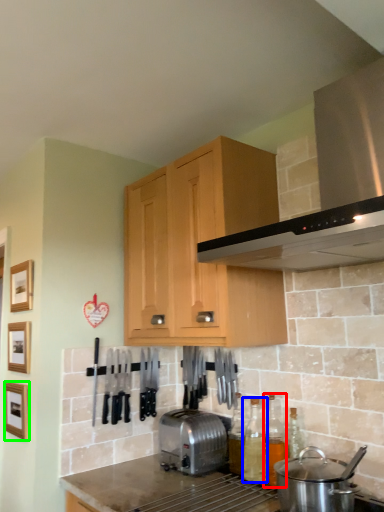
Question: Which object is positioned closest to bottle (highlighted by a red box)? Select from bottle (highlighted by a blue box) and picture frame (highlighted by a green box).

Choices:
 (A) bottle
 (B) picture frame

Answer: (A)